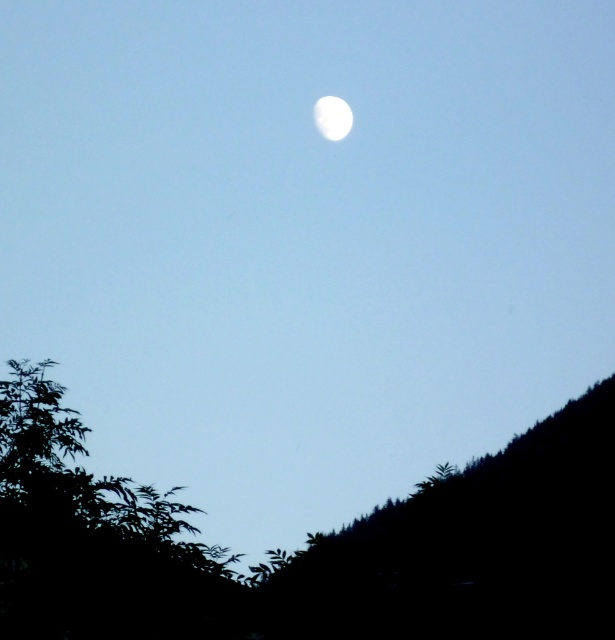
Question: Which point is farther from the camera taking this photo?

Choices:
 (A) (341, 576)
 (B) (330, 134)

Answer: (B)

Question: Among these points, which one is farthest from the camera?

Choices:
 (A) (354, 611)
 (B) (85, 477)

Answer: (B)

Question: Is green leafy tree at lower left further to camera compared to white glossy moon at upper center?

Choices:
 (A) no
 (B) yes

Answer: (A)

Question: Can you confirm if black matte hillside at lower right is bigger than white glossy moon at upper center?

Choices:
 (A) no
 (B) yes

Answer: (B)

Question: Does green leafy tree at lower left have a smaller size compared to white glossy moon at upper center?

Choices:
 (A) yes
 (B) no

Answer: (B)

Question: Which object is farther from the camera taking this photo?

Choices:
 (A) black matte hillside at lower right
 (B) white glossy moon at upper center
 (C) green leafy tree at lower left

Answer: (B)